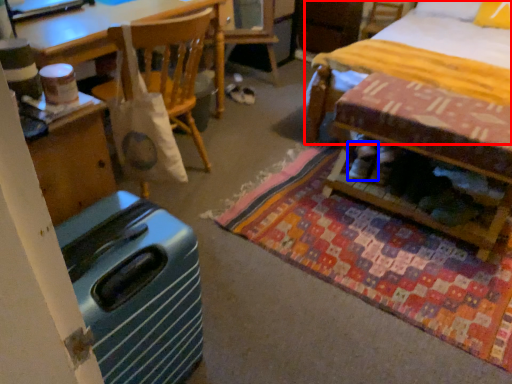
Question: Among these objects, which one is nearest to the camera, bed (highlighted by a red box) or footwear (highlighted by a blue box)?

Choices:
 (A) bed
 (B) footwear

Answer: (A)